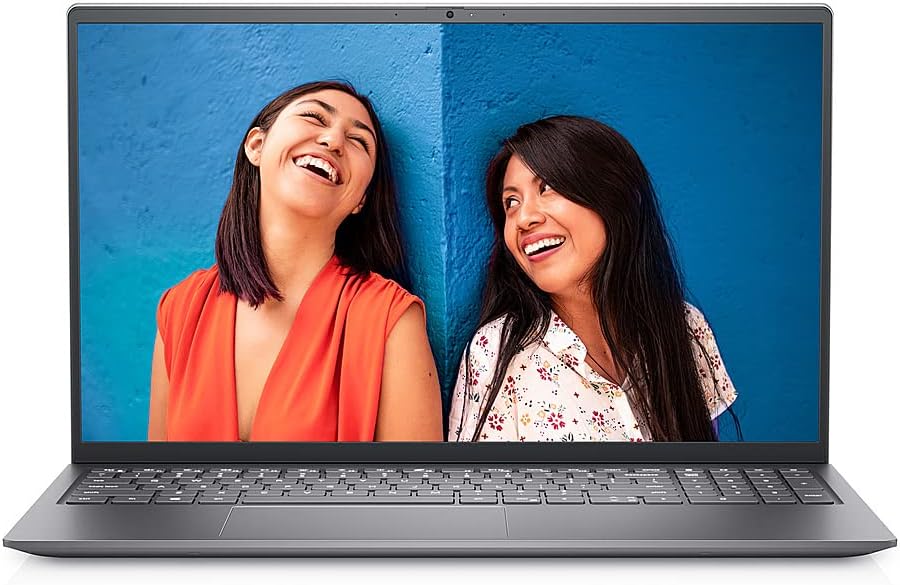
Identify the location of right of touchpad on laptop. Image resolution: width=900 pixels, height=585 pixels. [738, 533].